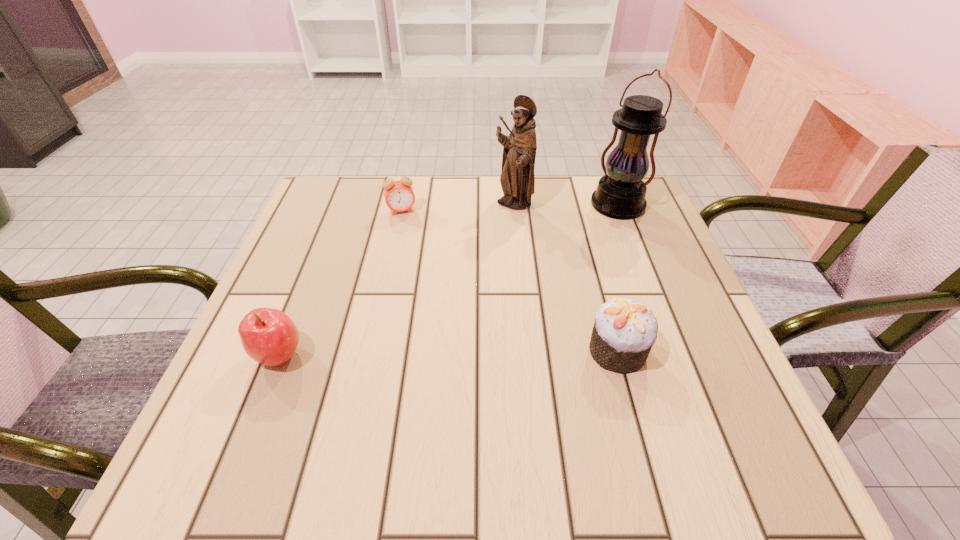
Identify the location of apple that is at the near edge. Image resolution: width=960 pixels, height=540 pixels. (268, 336).

Locate an element on the screen. This screenshot has height=540, width=960. cupcake at the near edge is located at coordinates (624, 331).

This screenshot has height=540, width=960. Find the location of `object that is at the left edge`. object that is at the left edge is located at coordinates (268, 336).

The image size is (960, 540). In order to click on cupcake positioned at the right edge in this screenshot , I will do `click(624, 331)`.

You are a GUI agent. You are given a task and a screenshot of the screen. Output one action in this format:
    pyautogui.click(x=<x>, y=<y>)
    Task: Click on the lantern present at the right edge
    The height and width of the screenshot is (540, 960).
    Given the screenshot: What is the action you would take?
    pyautogui.click(x=620, y=194)

Identify the location of object that is at the near left corner. This screenshot has width=960, height=540. (268, 336).

The width and height of the screenshot is (960, 540). Find the location of `object that is positioned at the far right corner`. object that is positioned at the far right corner is located at coordinates (620, 194).

Image resolution: width=960 pixels, height=540 pixels. What are the coordinates of `object present at the near right corner` in the screenshot? It's located at (624, 331).

In the image, there is a desktop. Identify the location of free space at the far edge. (550, 197).

Identify the location of free space at the near edge of the desktop. The image size is (960, 540). (407, 383).